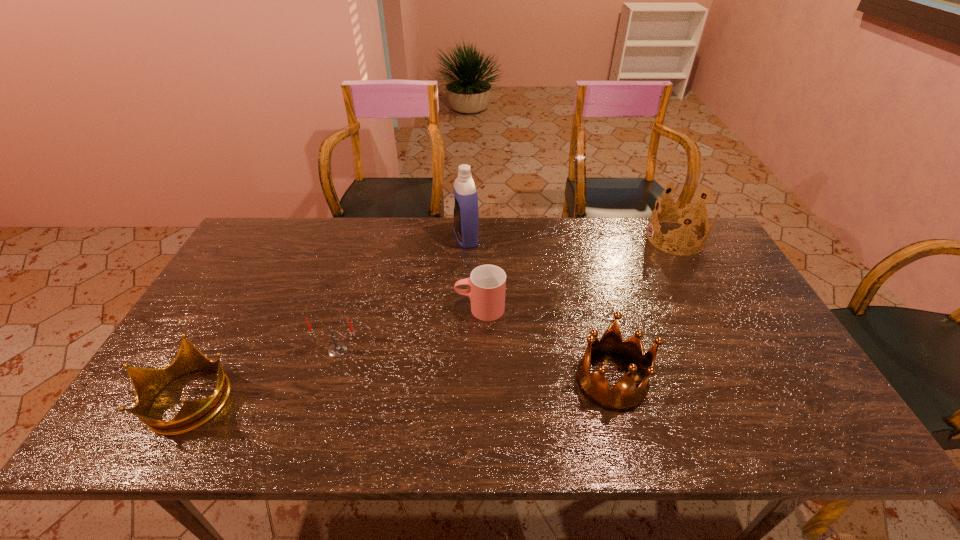
Locate an element on the screen. The image size is (960, 540). object located in the near left corner section of the desktop is located at coordinates (147, 383).

You are a GUI agent. You are given a task and a screenshot of the screen. Output one action in this format:
    pyautogui.click(x=<x>, y=<y>)
    Task: Click on the object at the far right corner
    The width and height of the screenshot is (960, 540).
    Given the screenshot: What is the action you would take?
    pyautogui.click(x=684, y=213)

Locate an element on the screen. The image size is (960, 540). vacant area at the far edge of the desktop is located at coordinates (516, 259).

In the image, there is a desktop. At what (x,y) coordinates should I click in order to perform the action: click on blank space at the near edge. Please return your answer as a coordinate pair (x, y). This screenshot has height=540, width=960. Looking at the image, I should click on (536, 437).

In the image, there is a desktop. Identify the location of vacant space at the left edge. The image size is (960, 540). (279, 264).

In the image, there is a desktop. Identify the location of vacant space at the right edge. The height and width of the screenshot is (540, 960). (698, 281).

The height and width of the screenshot is (540, 960). Identify the location of vacant area between the leftmost crown and the fifth object from right to left. (263, 374).

The image size is (960, 540). I want to click on empty space between the leftmost object and the detergent, so click(327, 318).

Identify the location of vacant region between the candle and the tallest object. (402, 294).

Locate an element on the screen. The width and height of the screenshot is (960, 540). free point between the second object from right to left and the shortest crown is located at coordinates (399, 389).